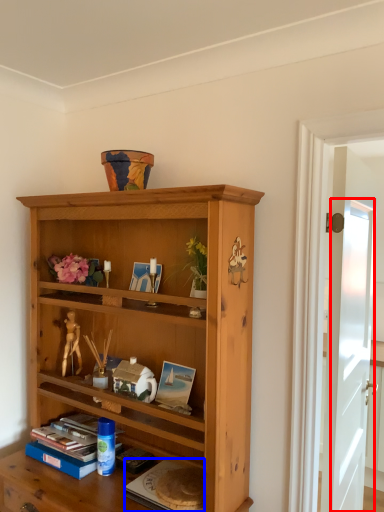
Question: Which object is closer to the camera taking this photo, glass door (highlighted by a red box) or paperback book (highlighted by a blue box)?

Choices:
 (A) glass door
 (B) paperback book

Answer: (B)